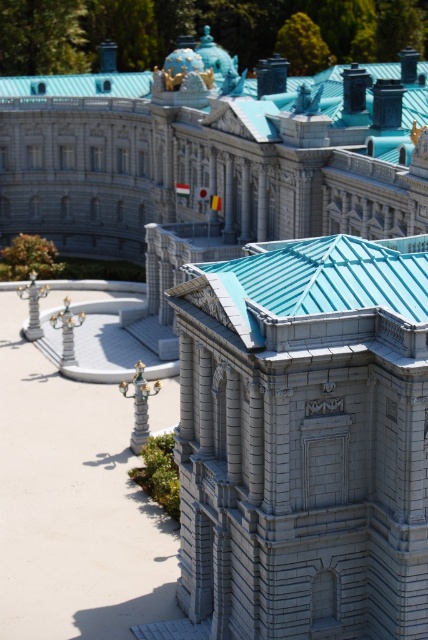
From the picture: You are an architect examining the miniature model of the palace. You notice the gray stone tower at center and the smooth white palace at center. Which one is positioned higher in the image?

The smooth white palace at center is positioned higher than the gray stone tower at center because the gray stone tower at center is located below it.

You are an architect reviewing the miniature model of a grand structure. You notice the gray stone tower at center and the smooth white palace at center. Which of these two structures is taller?

The gray stone tower at center is shorter than the smooth white palace at center, so the smooth white palace at center is taller.